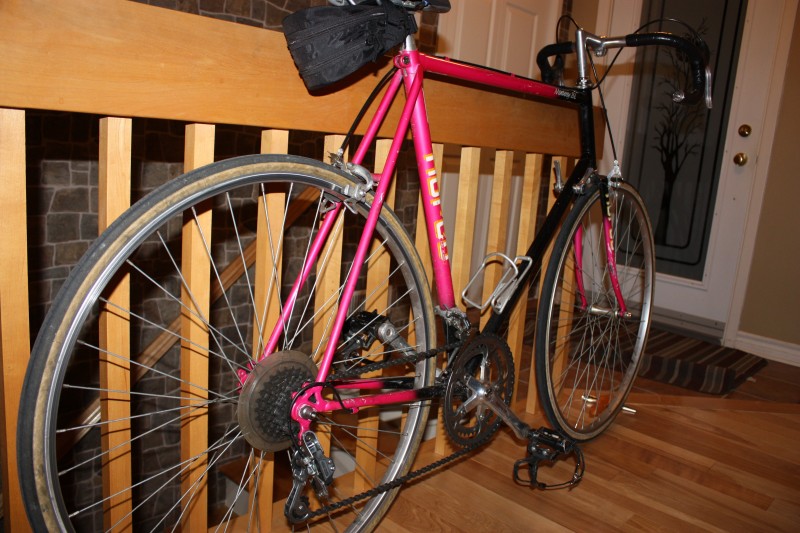
Identify the location of hardwood floor. This screenshot has width=800, height=533. (661, 471).